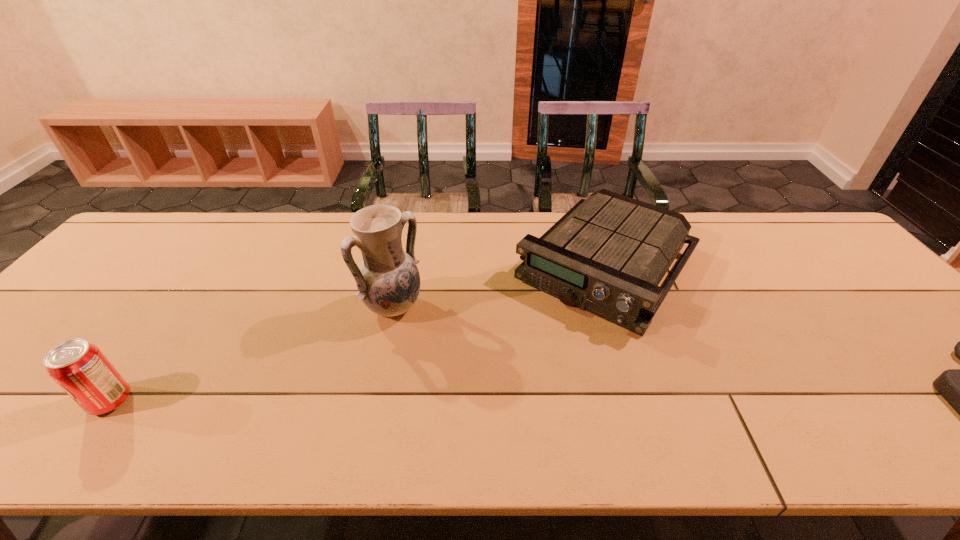
Locate an element on the screen. This screenshot has height=540, width=960. free region located 0.280m on either side of the third object from right to left is located at coordinates (493, 389).

Where is `vacant area situated on either side of the third object from right to left`? This screenshot has height=540, width=960. vacant area situated on either side of the third object from right to left is located at coordinates (493, 389).

Find the location of a particular element. object positioned at the far edge is located at coordinates (607, 255).

This screenshot has height=540, width=960. Find the location of `object that is at the near edge`. object that is at the near edge is located at coordinates (80, 368).

The image size is (960, 540). In the image, there is a desktop. Identify the location of free space at the far edge. (742, 244).

In the image, there is a desktop. Identify the location of free space at the near edge. This screenshot has height=540, width=960. click(352, 378).

Locate an element on the screen. This screenshot has height=540, width=960. vacant space at the left edge of the desktop is located at coordinates (106, 275).

Locate an element on the screen. The width and height of the screenshot is (960, 540). free spot at the far left corner of the desktop is located at coordinates (170, 248).

What are the coordinates of `free space at the far right corner` in the screenshot? It's located at (792, 237).

Where is `vacant area that lies between the second object from right to left and the soda`? This screenshot has width=960, height=540. vacant area that lies between the second object from right to left and the soda is located at coordinates (359, 333).